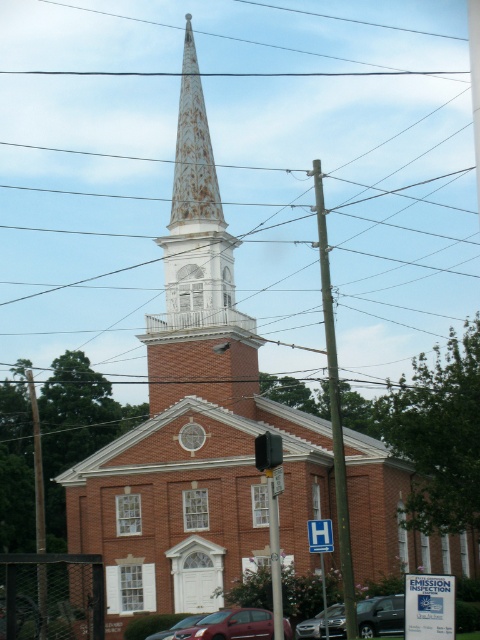
Who is more forward, (214,237) or (169,630)?

Point (169,630)

Between point (175, 349) and point (173, 625), which one is positioned in front?

Point (173, 625) is in front.

Identify the location of white textured steeple at center. This screenshot has width=480, height=640. (199, 284).

Which is behind, point (342, 609) or point (170, 632)?

The point (342, 609) is behind.

Is satin silver car at lower center positioned before metallic red car at center?

Yes, satin silver car at lower center is in front of metallic red car at center.

Between point (339, 609) and point (176, 627), which one is positioned behind?

The point (176, 627) is more distant.

Image resolution: width=480 pixels, height=640 pixels. In order to click on satin silver car at lower center in this screenshot , I will do tap(310, 627).

Between brown wooden utility pole at center and metallic red car at center, which one appears on the right side from the viewer's perspective?

brown wooden utility pole at center is more to the right.

The image size is (480, 640). What are the coordinates of `brown wooden utility pole at center` in the screenshot? It's located at (335, 412).